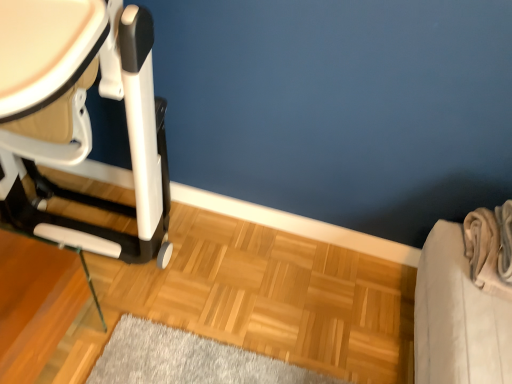
Measure the distance between matte white highchair at left and camera.

matte white highchair at left is 26.04 inches from camera.

What do you see at coordinates (80, 118) in the screenshot? I see `matte white highchair at left` at bounding box center [80, 118].

Locate an element on the screen. The width and height of the screenshot is (512, 384). matte white highchair at left is located at coordinates (80, 118).

At what (x,y) coordinates should I click in order to perform the action: click on matte white highchair at left. Please return your answer as a coordinate pair (x, y). This screenshot has width=512, height=384. Looking at the image, I should click on (80, 118).